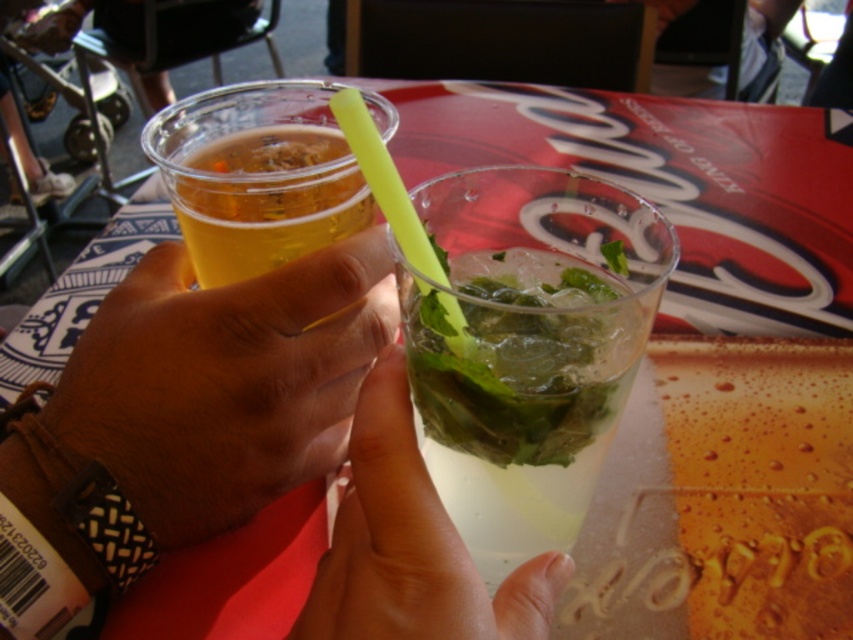
Who is more forward, (x=339, y=460) or (x=547, y=541)?

Positioned in front is point (x=547, y=541).

Who is lower down, smooth skin hand at center or clear glass at center?

clear glass at center is below.

Measure the distance between point (279, 317) and camera.

9.12 inches

Locate an element on the screen. The height and width of the screenshot is (640, 853). smooth skin hand at center is located at coordinates (224, 381).

Can you confirm if translucent glass at center is positioned to the left of translucent plastic cup at center?

In fact, translucent glass at center is to the right of translucent plastic cup at center.

Between translucent glass at center and translucent plastic cup at center, which one appears on the right side from the viewer's perspective?

Positioned to the right is translucent glass at center.

Between point (386, 518) and point (213, 186), which one is positioned in front?

Point (386, 518) is in front.

This screenshot has height=640, width=853. I want to click on translucent glass at center, so click(x=410, y=545).

Can you confirm if smooth skin hand at center is positioned to the right of translucent glass at center?

No, smooth skin hand at center is not to the right of translucent glass at center.

You are a GUI agent. You are given a task and a screenshot of the screen. Output one action in this format:
    pyautogui.click(x=<x>, y=<y>)
    Task: Click on the smooth skin hand at center
    
    Given the screenshot: What is the action you would take?
    pyautogui.click(x=224, y=381)